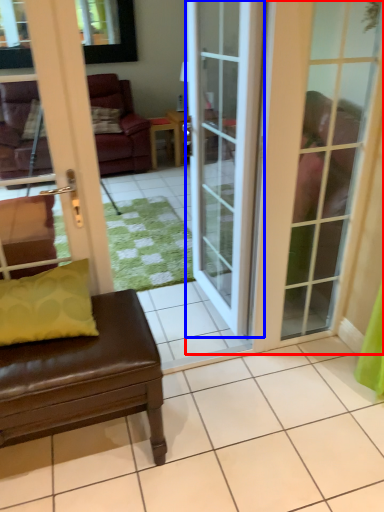
Question: Which point is further to the camera, door (highlighted by a red box) or door (highlighted by a blue box)?

Choices:
 (A) door
 (B) door

Answer: (B)